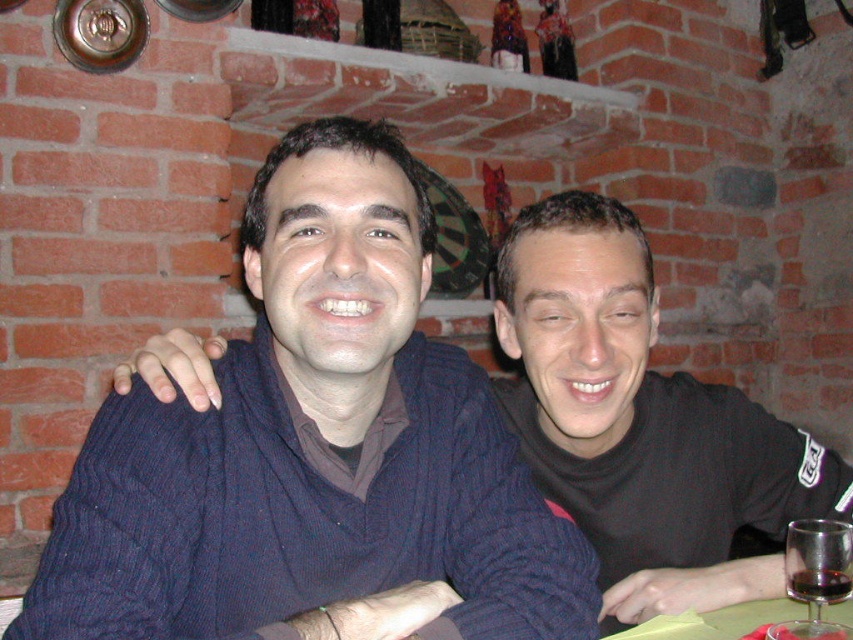
Question: Which object is farther from the camera taking this photo?

Choices:
 (A) smooth glass table at lower right
 (B) dark red liquid at lower right
 (C) transparent glass at lower right

Answer: (A)

Question: Does smooth glass table at lower right have a lesser width compared to dark red liquid at lower right?

Choices:
 (A) no
 (B) yes

Answer: (A)

Question: Considering the real-world distances, which object is farthest from the cable-knit sweater at center?

Choices:
 (A) transparent glass at lower right
 (B) dark red liquid at lower right

Answer: (B)

Question: Which object is closer to the camera taking this photo?

Choices:
 (A) smooth glass table at lower right
 (B) dark red liquid at lower right

Answer: (B)

Question: Can you confirm if transparent glass at lower right is positioned to the left of smooth glass table at lower right?

Choices:
 (A) yes
 (B) no

Answer: (B)

Question: Does cable-knit sweater at center have a lesser width compared to smooth glass table at lower right?

Choices:
 (A) yes
 (B) no

Answer: (B)